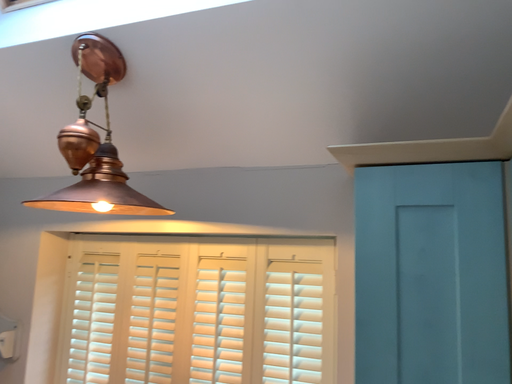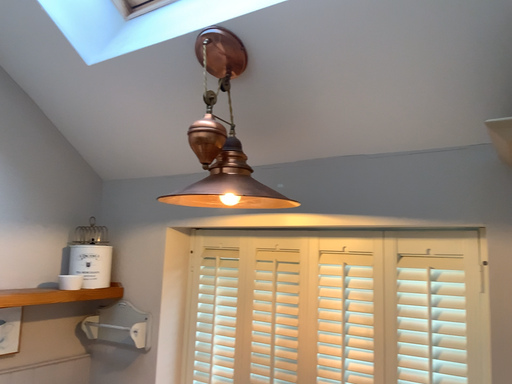
Question: How did the camera likely rotate when shooting the video?

Choices:
 (A) rotated left
 (B) rotated right

Answer: (A)